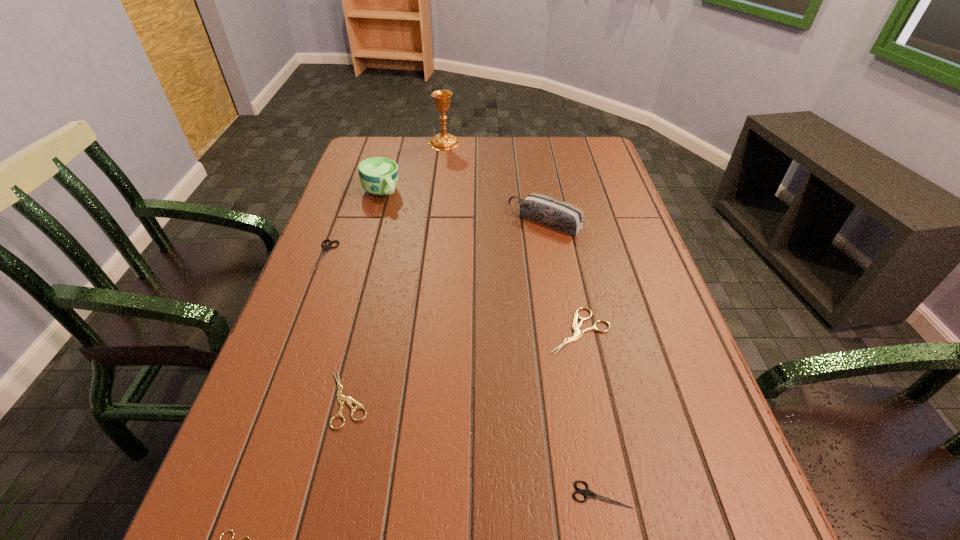
Where is `vacant region located on the right of the nearer black shears`? This screenshot has width=960, height=540. vacant region located on the right of the nearer black shears is located at coordinates (702, 495).

Identify the location of object located at the far edge. (443, 141).

The image size is (960, 540). In order to click on cup present at the left edge in this screenshot , I will do `click(378, 176)`.

Where is `pencil box positioned at the right edge`? Image resolution: width=960 pixels, height=540 pixels. pencil box positioned at the right edge is located at coordinates (554, 213).

At what (x,y) coordinates should I click in order to perform the action: click on shears that is at the right edge. Please return your answer as a coordinate pair (x, y). Looking at the image, I should click on (578, 333).

Image resolution: width=960 pixels, height=540 pixels. I want to click on vacant space at the far edge of the desktop, so click(x=510, y=147).

Locate an element on the screen. This screenshot has width=960, height=540. free location at the left edge is located at coordinates (297, 484).

In the image, there is a desktop. At what (x,y) coordinates should I click in order to perform the action: click on free region at the right edge. Please return your answer as a coordinate pair (x, y). Looking at the image, I should click on (573, 200).

Where is `vacant area at the far right corner of the desktop`? The width and height of the screenshot is (960, 540). vacant area at the far right corner of the desktop is located at coordinates (580, 138).

You are a GUI agent. You are given a task and a screenshot of the screen. Output one action in this format:
    pyautogui.click(x=<x>, y=<y>)
    Task: Click on the free space between the farther black shears and the sixth nearest object
    The height and width of the screenshot is (540, 960).
    Given the screenshot: What is the action you would take?
    pyautogui.click(x=436, y=239)